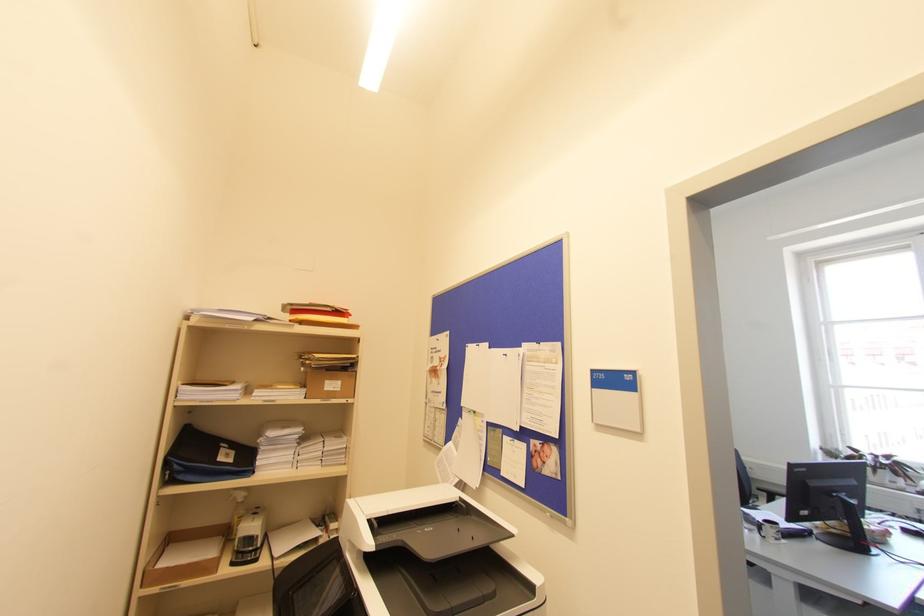
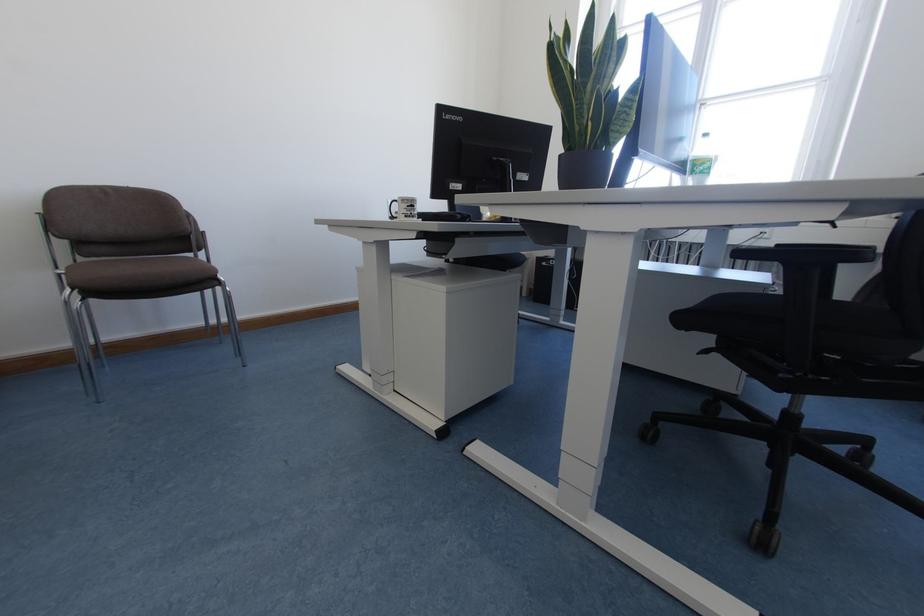
Locate, in the second image, the point that corresponds to point (775, 539) in the first image.

(405, 216)